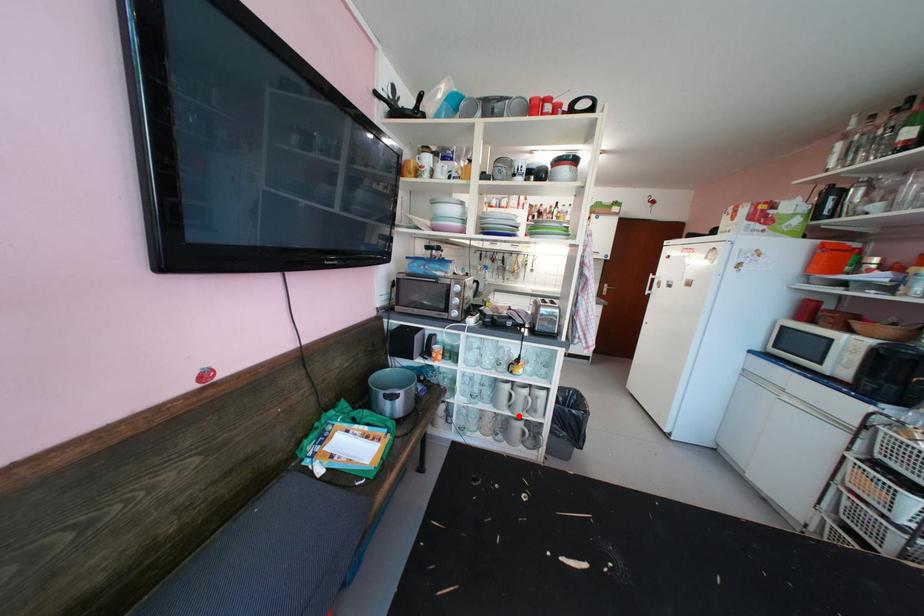
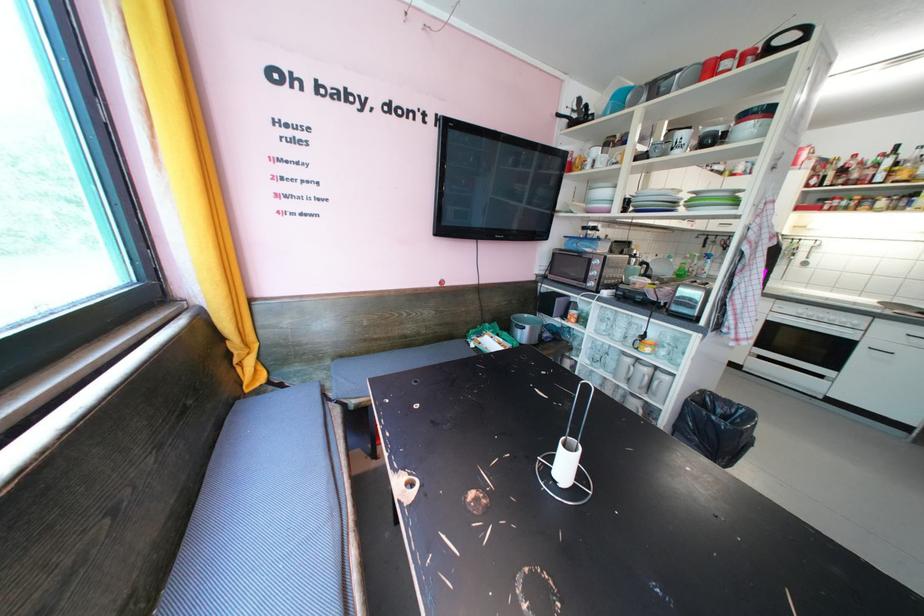
In the second image, find the point that corresponds to the highlighted location in the first image.

(635, 390)